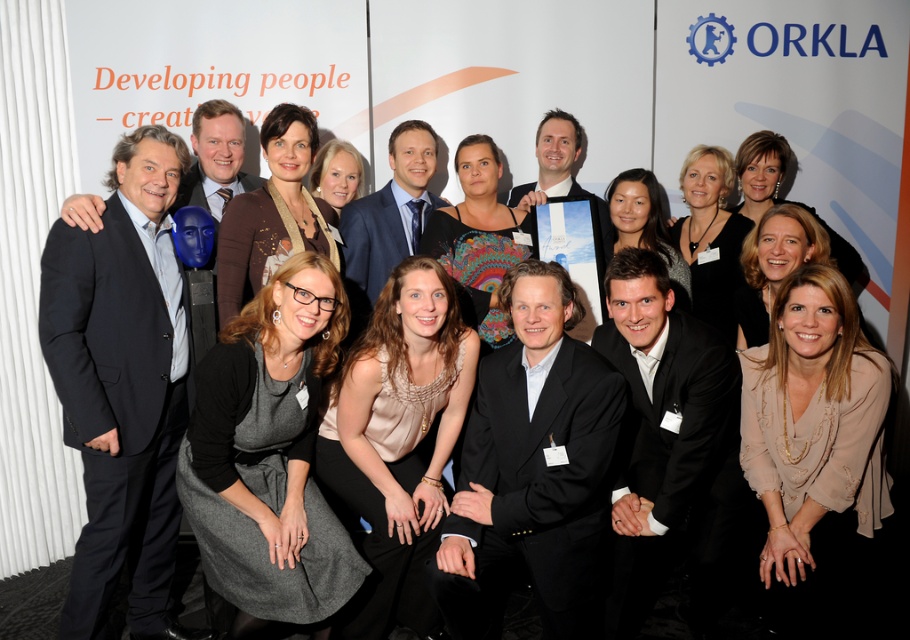
Does beige satin blouse at lower right lie in front of matte beige blouse at center?

Yes, it is.

Is point (823, 426) less distant than point (322, 483)?

Yes.

Is point (774, 304) closer to viewer compared to point (349, 458)?

Yes, point (774, 304) is closer to viewer.

At what (x,y) coordinates should I click in order to perform the action: click on beige satin blouse at lower right. Please return your answer as a coordinate pair (x, y). This screenshot has width=910, height=640. Looking at the image, I should click on (814, 445).

Can you confirm if dark blue suit at left is thinner than matte brown dress at center?

No.

Is dark blue suit at left to the left of matte brown dress at center from the viewer's perspective?

Indeed, dark blue suit at left is positioned on the left side of matte brown dress at center.

Between point (170, 148) and point (217, 276), which one is positioned in front?

Positioned in front is point (170, 148).

At what (x,y) coordinates should I click in order to perform the action: click on dark blue suit at left. Please return your answer as a coordinate pair (x, y). This screenshot has height=640, width=910. Looking at the image, I should click on (122, 385).

Does black suit at center appear under matte beige blouse at center?

Indeed, black suit at center is positioned under matte beige blouse at center.

Does black suit at center have a lesser width compared to matte beige blouse at center?

Incorrect, black suit at center's width is not less than matte beige blouse at center's.

Does point (565, 412) come behind point (359, 397)?

That is False.

This screenshot has width=910, height=640. Identify the location of black suit at center. (532, 470).